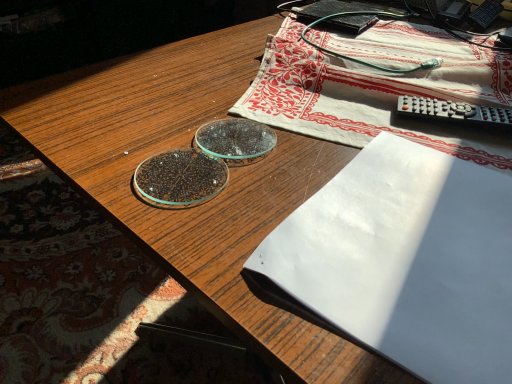
Locate an element on the screen. The image size is (512, 384). free spot to the left of white paper at center is located at coordinates (219, 195).